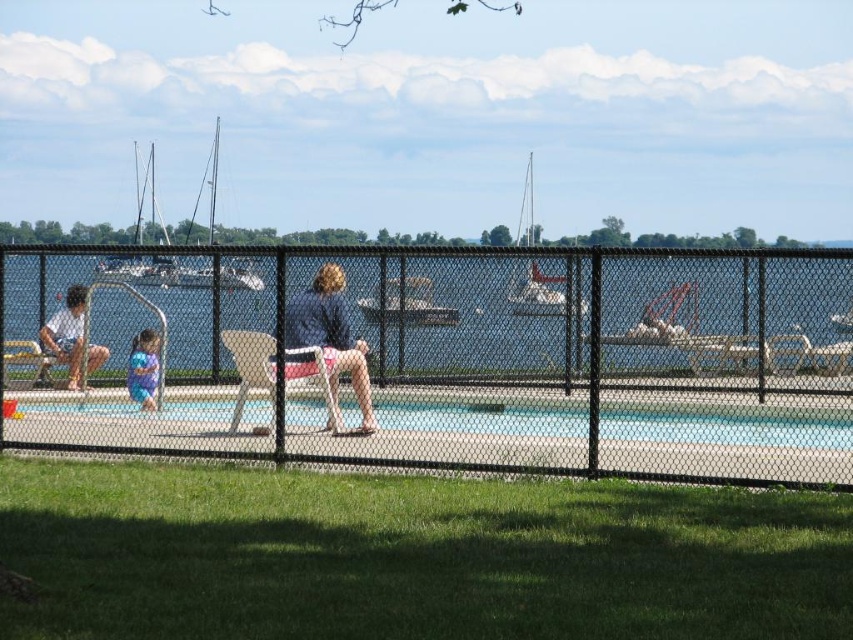
Does white glossy sailboat at center appear under matte purple swimsuit at left?

No.

Is white glossy sailboat at center above matte purple swimsuit at left?

Yes.

What are the coordinates of `white glossy sailboat at center` in the screenshot? It's located at (218, 275).

Between white sailboat at left and matte white shorts at left, which one has less height?

Standing shorter between the two is matte white shorts at left.

Looking at this image, is white sailboat at left further to camera compared to matte white shorts at left?

No.

You are a GUI agent. You are given a task and a screenshot of the screen. Output one action in this format:
    pyautogui.click(x=<x>, y=<y>)
    Task: Click on the white sailboat at left
    The height and width of the screenshot is (640, 853).
    Given the screenshot: What is the action you would take?
    pyautogui.click(x=138, y=268)

Between blue smooth pool at center and matte purple swimsuit at left, which one has more height?

With more height is matte purple swimsuit at left.

Does blue smooth pool at center appear on the right side of matte purple swimsuit at left?

In fact, blue smooth pool at center is to the left of matte purple swimsuit at left.

In order to click on blue smooth pool at center in this screenshot , I will do `click(727, 420)`.